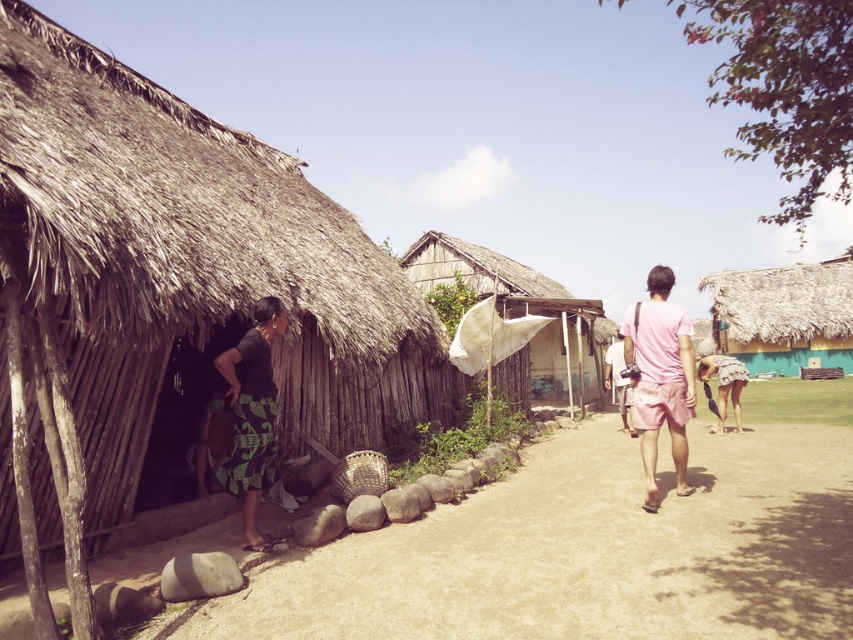
Question: Which of the following is the closest to the observer?

Choices:
 (A) green printed skirt at lower left
 (B) pink cotton shirt at center-right
 (C) thatched straw hut at right

Answer: (A)

Question: Does thatched straw hut at right have a greater width compared to pink cotton shirt at center?

Choices:
 (A) yes
 (B) no

Answer: (A)

Question: Which point appears farthest from the camera in this image?

Choices:
 (A) (253, 416)
 (B) (625, 380)
 (C) (740, 417)

Answer: (B)

Question: Which object appears farthest from the camera in this image?

Choices:
 (A) pink cotton shirt at center
 (B) green printed skirt at lower left

Answer: (A)

Question: In this image, where is brown dirt path at lower center located relative to white cotton dress at lower right?

Choices:
 (A) right
 (B) left

Answer: (B)

Question: Can you confirm if brown dirt path at lower center is thinner than thatched wood hut at center?

Choices:
 (A) no
 (B) yes

Answer: (A)